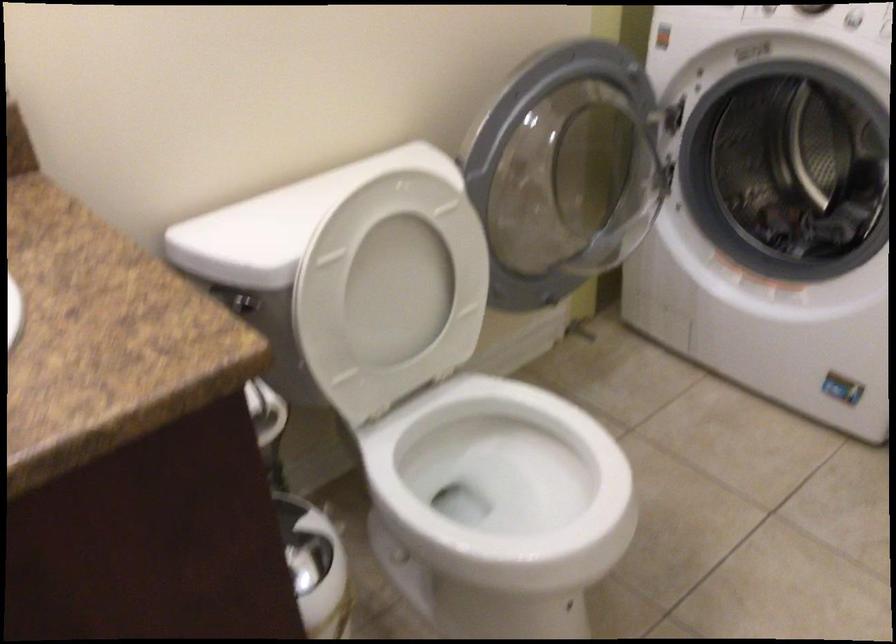
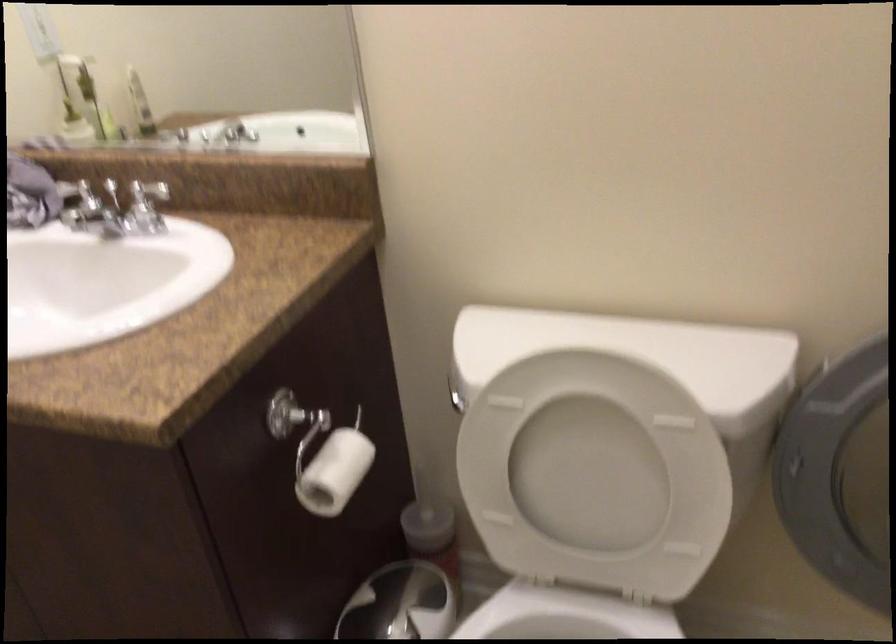
The point at [391,297] is marked in the first image. Where is the corresponding point in the second image?

(595, 475)